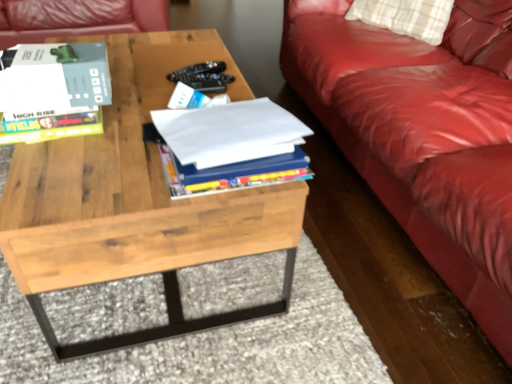
I want to click on white paper at center, marked as the 2th book in a left-to-right arrangement, so click(x=231, y=146).

Is natural wood coffee table at center at the right side of white paper at center, marked as the 2th book in a left-to-right arrangement?

No.

Is natural wood coffee table at center not near white paper at center, marked as the 2th book in a left-to-right arrangement?

That's not correct — natural wood coffee table at center is a little close to white paper at center, marked as the 2th book in a left-to-right arrangement.

From the image's perspective, is natural wood coffee table at center on top of white paper at center, marked as the 1th book in a right-to-left arrangement?

No, from the image's perspective, natural wood coffee table at center is not on top of white paper at center, marked as the 1th book in a right-to-left arrangement.

I want to click on book that is the 1st one when counting backward from the natural wood coffee table at center, so click(231, 146).

Is white paper at center, marked as the 1th book in a right-to-left arrangement, looking in the opposite direction of natural wood coffee table at center?

No, white paper at center, marked as the 1th book in a right-to-left arrangement,'s orientation is not away from natural wood coffee table at center.

Considering the sizes of objects white paper at center, marked as the 1th book in a right-to-left arrangement, and natural wood coffee table at center in the image provided, who is taller, white paper at center, marked as the 1th book in a right-to-left arrangement, or natural wood coffee table at center?

natural wood coffee table at center.

Between white paper at center, marked as the 2th book in a left-to-right arrangement, and matte gray book at upper left, arranged as the first book when viewed from the left, which one has larger size?

Bigger between the two is white paper at center, marked as the 2th book in a left-to-right arrangement.

Is point (286, 158) less distant than point (101, 45)?

Yes, it is.

What's the angular difference between white paper at center, marked as the 1th book in a right-to-left arrangement, and matte gray book at upper left, which appears as the 2th book when viewed from the right,'s facing directions?

The facing directions of white paper at center, marked as the 1th book in a right-to-left arrangement, and matte gray book at upper left, which appears as the 2th book when viewed from the right, are 179 degrees apart.

Is white paper at center, marked as the 2th book in a left-to-right arrangement, completely or partially outside of matte gray book at upper left, which appears as the 2th book when viewed from the right?

Indeed, white paper at center, marked as the 2th book in a left-to-right arrangement, is completely outside matte gray book at upper left, which appears as the 2th book when viewed from the right.

Considering the positions of point (77, 114) and point (256, 104), is point (77, 114) closer or farther from the camera than point (256, 104)?

Point (77, 114) appears to be closer to the viewer than point (256, 104).

Is matte gray book at upper left, arranged as the first book when viewed from the left, at the left side of white paper at center, marked as the 1th book in a right-to-left arrangement?

Yes, matte gray book at upper left, arranged as the first book when viewed from the left, is to the left of white paper at center, marked as the 1th book in a right-to-left arrangement.

Consider the image. From a real-world perspective, is matte gray book at upper left, arranged as the first book when viewed from the left, positioned over white paper at center, marked as the 2th book in a left-to-right arrangement, based on gravity?

Yes.

Which object is wider, matte gray book at upper left, arranged as the first book when viewed from the left, or white paper at center, marked as the 2th book in a left-to-right arrangement?

Wider between the two is white paper at center, marked as the 2th book in a left-to-right arrangement.

From a real-world perspective, who is located higher, matte gray book at upper left, which appears as the 2th book when viewed from the right, or natural wood coffee table at center?

matte gray book at upper left, which appears as the 2th book when viewed from the right, from a real-world perspective.

Is matte gray book at upper left, which appears as the 2th book when viewed from the right, taller than natural wood coffee table at center?

No, matte gray book at upper left, which appears as the 2th book when viewed from the right, is not taller than natural wood coffee table at center.

Which is more distant, (28, 56) or (219, 214)?

Positioned behind is point (28, 56).

Can you tell me how much natural wood coffee table at center and matte gray book at upper left, which appears as the 2th book when viewed from the right, differ in facing direction?

They differ by 1.18 degrees in their facing directions.

Which of these two, natural wood coffee table at center or matte gray book at upper left, which appears as the 2th book when viewed from the right, stands taller?

natural wood coffee table at center.

Between natural wood coffee table at center and matte gray book at upper left, which appears as the 2th book when viewed from the right, which one has smaller size?

matte gray book at upper left, which appears as the 2th book when viewed from the right, is smaller.

Is the position of natural wood coffee table at center more distant than that of matte gray book at upper left, which appears as the 2th book when viewed from the right?

No, the depth of natural wood coffee table at center is less than that of matte gray book at upper left, which appears as the 2th book when viewed from the right.

Find the location of a particular element. coffee table below the white paper at center, marked as the 2th book in a left-to-right arrangement (from the image's perspective) is located at coordinates (135, 200).

Identify the location of book to the right of natural wood coffee table at center. Image resolution: width=512 pixels, height=384 pixels. 231,146.

Considering their positions, is white paper at center, marked as the 2th book in a left-to-right arrangement, positioned further to natural wood coffee table at center than matte gray book at upper left, which appears as the 2th book when viewed from the right?

matte gray book at upper left, which appears as the 2th book when viewed from the right.

When comparing their distances from white paper at center, marked as the 2th book in a left-to-right arrangement, does matte gray book at upper left, which appears as the 2th book when viewed from the right, or natural wood coffee table at center seem closer?

natural wood coffee table at center.

Looking at this image, which object lies further to the anchor point matte gray book at upper left, arranged as the first book when viewed from the left, natural wood coffee table at center or white paper at center, marked as the 2th book in a left-to-right arrangement?

white paper at center, marked as the 2th book in a left-to-right arrangement, is further to matte gray book at upper left, arranged as the first book when viewed from the left.

Estimate the real-world distances between objects in this image. Which object is further from natural wood coffee table at center, matte gray book at upper left, which appears as the 2th book when viewed from the right, or white paper at center, marked as the 2th book in a left-to-right arrangement?

The object further to natural wood coffee table at center is matte gray book at upper left, which appears as the 2th book when viewed from the right.

When comparing their distances from white paper at center, marked as the 1th book in a right-to-left arrangement, does natural wood coffee table at center or matte gray book at upper left, which appears as the 2th book when viewed from the right, seem further?

Based on the image, matte gray book at upper left, which appears as the 2th book when viewed from the right, appears to be further to white paper at center, marked as the 1th book in a right-to-left arrangement.

From the image, which object appears to be farther from matte gray book at upper left, which appears as the 2th book when viewed from the right, white paper at center, marked as the 1th book in a right-to-left arrangement, or natural wood coffee table at center?

white paper at center, marked as the 1th book in a right-to-left arrangement, is positioned further to the anchor matte gray book at upper left, which appears as the 2th book when viewed from the right.

Locate an element on the screen. The height and width of the screenshot is (384, 512). coffee table between matte gray book at upper left, arranged as the first book when viewed from the left, and white paper at center, marked as the 2th book in a left-to-right arrangement is located at coordinates (135, 200).